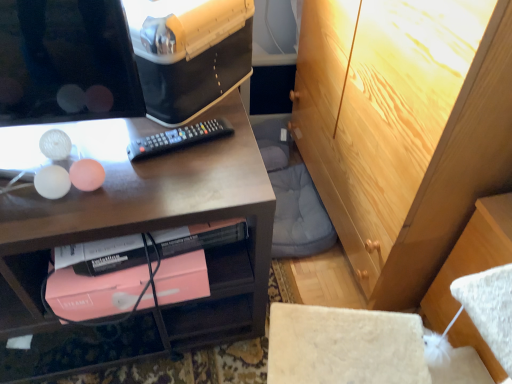
You are a GUI agent. You are given a task and a screenshot of the screen. Output one action in this format:
    pyautogui.click(x=<x>, y=<y>)
    Task: Click on the vacant space behind black plastic remote at center
    The width and height of the screenshot is (512, 384).
    Given the screenshot: What is the action you would take?
    pyautogui.click(x=199, y=112)